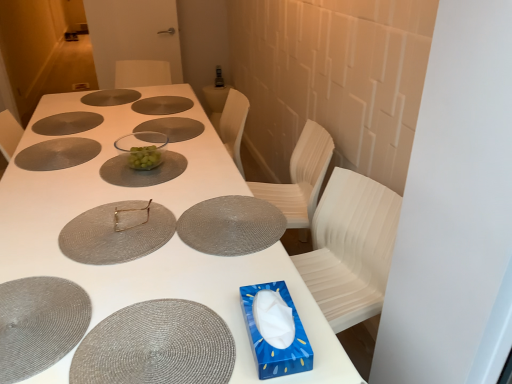
This screenshot has width=512, height=384. Identify the location of free space between matte gray glass plate at upper left, which is counted as the 7th glass plate, starting from the front, and transparent glass bowl at center, acting as the 6th glass plate starting from the front. (99, 127).